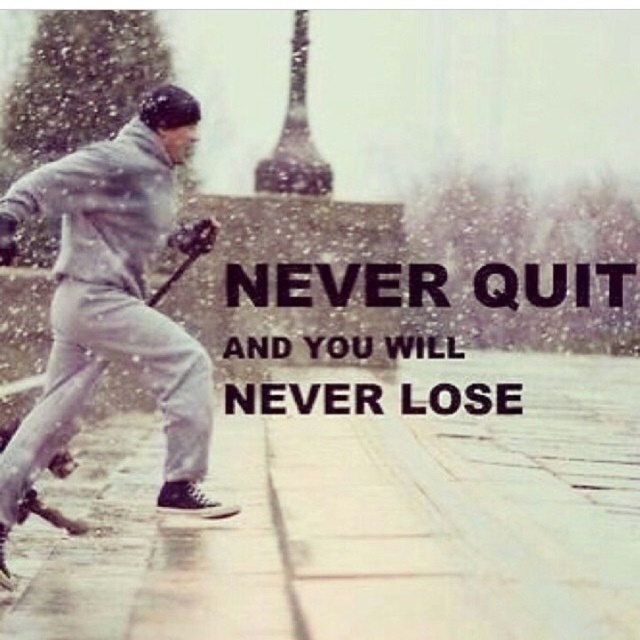
Who is more distant from viewer, (115, 189) or (177, 272)?

The point (177, 272) is behind.

Between point (96, 307) and point (19, 387), which one is positioned in front?

Point (96, 307)

This screenshot has height=640, width=640. I want to click on gray matte ski pants at left, so click(x=115, y=296).

Locate an element on the screen. gray matte ski pants at left is located at coordinates (115, 296).

Does gray matte ski pants at left appear over shiny metallic eiffel tower at upper center?

Actually, gray matte ski pants at left is below shiny metallic eiffel tower at upper center.

Between gray matte ski pants at left and shiny metallic eiffel tower at upper center, which one is positioned higher?

shiny metallic eiffel tower at upper center is above.

Describe the element at coordinates (115, 296) in the screenshot. The image size is (640, 640). I see `gray matte ski pants at left` at that location.

I want to click on gray matte ski pants at left, so click(x=115, y=296).

Between shiny metallic eiffel tower at upper center and wooden bat at left, which one appears on the left side from the viewer's perspective?

Positioned to the left is wooden bat at left.

Can you confirm if shiny metallic eiffel tower at upper center is positioned below wooden bat at left?

Incorrect, shiny metallic eiffel tower at upper center is not positioned below wooden bat at left.

Image resolution: width=640 pixels, height=640 pixels. What are the coordinates of `shiny metallic eiffel tower at upper center` in the screenshot? It's located at (294, 132).

Where is `shiny metallic eiffel tower at upper center`? The height and width of the screenshot is (640, 640). shiny metallic eiffel tower at upper center is located at coordinates (294, 132).